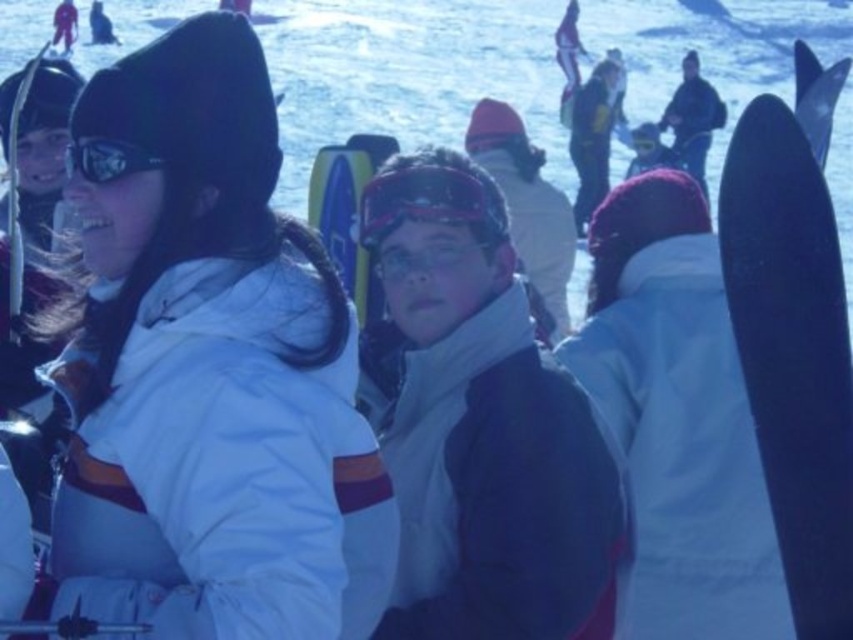
Question: Is matte blue jacket at center below black matte ski at right?

Choices:
 (A) yes
 (B) no

Answer: (A)

Question: Which point is farther to the camera?

Choices:
 (A) matte blue jacket at center
 (B) white matte jacket at upper left

Answer: (A)

Question: Which point is farther from the camera taking this photo?

Choices:
 (A) (795, 44)
 (B) (486, 369)
 (C) (383, 532)
 (D) (126, 160)

Answer: (A)

Question: Is black matte ski at right above matte black ski at left?

Choices:
 (A) yes
 (B) no

Answer: (B)

Question: Which of these objects is positioned farthest from the white matte jacket at upper left?

Choices:
 (A) shiny purple goggles at center
 (B) matte black ski at left
 (C) black matte ski at right
 (D) matte blue jacket at center

Answer: (C)

Question: Considering the relative positions of matte black ski at left and matte black goggles at upper left in the image provided, where is matte black ski at left located with respect to matte black goggles at upper left?

Choices:
 (A) above
 (B) below

Answer: (A)